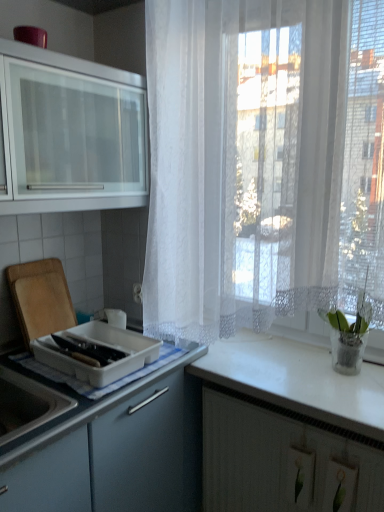
At what (x,y) coordinates should I click in order to perform the action: click on unoccupied area in front of green glass vase at right. Please return your answer as a coordinate pair (x, y). Looking at the image, I should click on (347, 396).